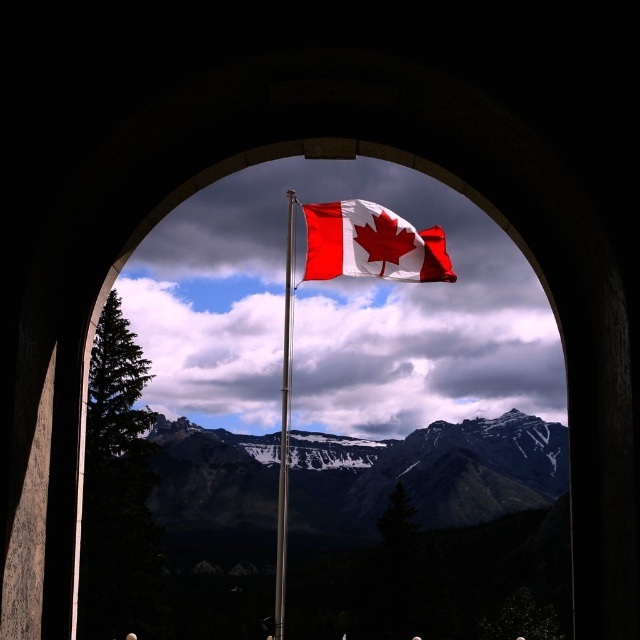
Question: Among these points, which one is nearest to the camera?

Choices:
 (A) (518, 419)
 (B) (365, 216)
 (C) (291, 314)

Answer: (B)

Question: In this image, where is snow-covered rocky mountain at center located relative to red and white fabric flag at center?

Choices:
 (A) above
 (B) below

Answer: (B)

Question: Among these objects, which one is nearest to the camera?

Choices:
 (A) red and white fabric flag at center
 (B) snow-covered rocky mountain at center
 (C) polished metal flag pole at center

Answer: (C)

Question: Is snow-covered rocky mountain at center wider than polished metal flag pole at center?

Choices:
 (A) no
 (B) yes

Answer: (B)

Question: Which point appears closest to the camera in this image?

Choices:
 (A) (358, 253)
 (B) (285, 516)
 (C) (524, 468)

Answer: (A)

Question: Can you confirm if snow-covered rocky mountain at center is positioned below polished metal flag pole at center?

Choices:
 (A) no
 (B) yes

Answer: (B)